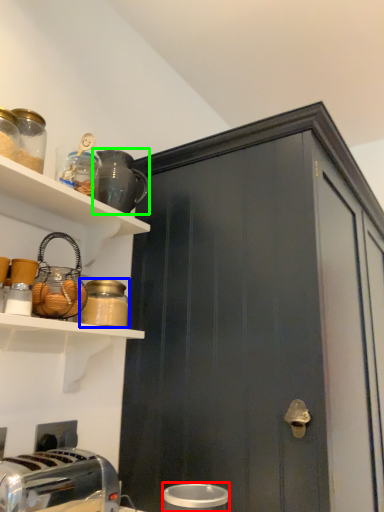
Question: Which is nearer to the appliance (highlighted by a red box)? bottle (highlighted by a blue box) or appliance (highlighted by a green box).

Choices:
 (A) bottle
 (B) appliance

Answer: (A)